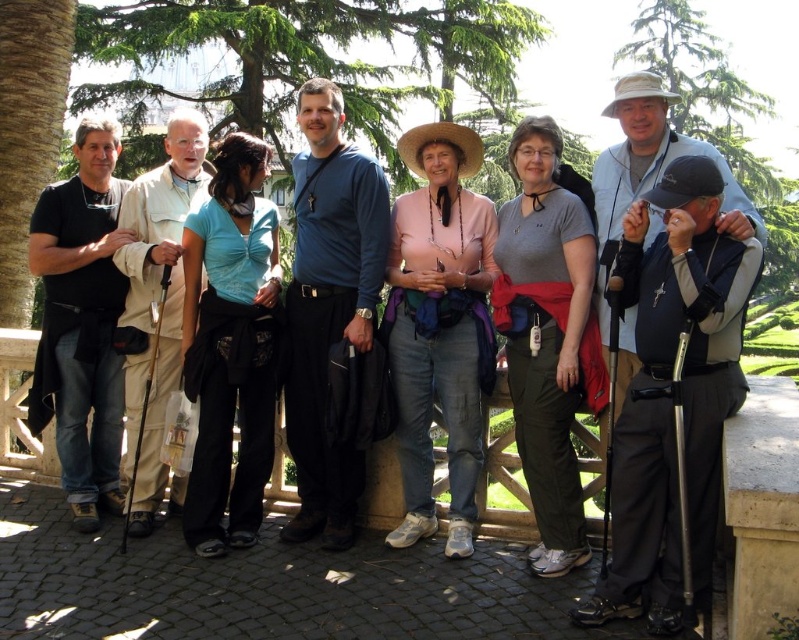
Is pink cotton shirt at center taller than black matte jacket at left?

Incorrect, pink cotton shirt at center's height is not larger of black matte jacket at left's.

At what (x,y) coordinates should I click in order to perform the action: click on pink cotton shirt at center. Please return your answer as a coordinate pair (x, y). This screenshot has width=799, height=640. Looking at the image, I should click on 439,324.

Does gray fabric shirt at center come in front of blue matte shirt at center?

Yes, it is in front of blue matte shirt at center.

Can you confirm if gray fabric shirt at center is shorter than blue matte shirt at center?

Indeed, gray fabric shirt at center has a lesser height compared to blue matte shirt at center.

Who is more distant from viewer, (574, 328) or (340, 540)?

The point (340, 540) is behind.

I want to click on gray fabric shirt at center, so click(x=547, y=332).

Does pink cotton shirt at center appear on the left side of gray fabric shirt at center?

Indeed, pink cotton shirt at center is positioned on the left side of gray fabric shirt at center.

Who is more distant from viewer, (464,268) or (535,465)?

Point (464,268)

Identify the location of pink cotton shirt at center. (439, 324).